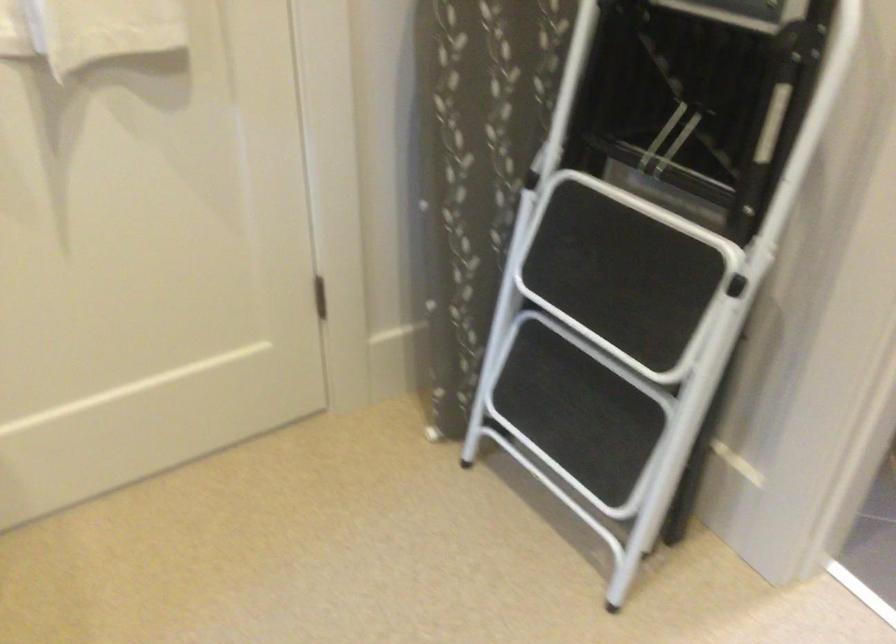
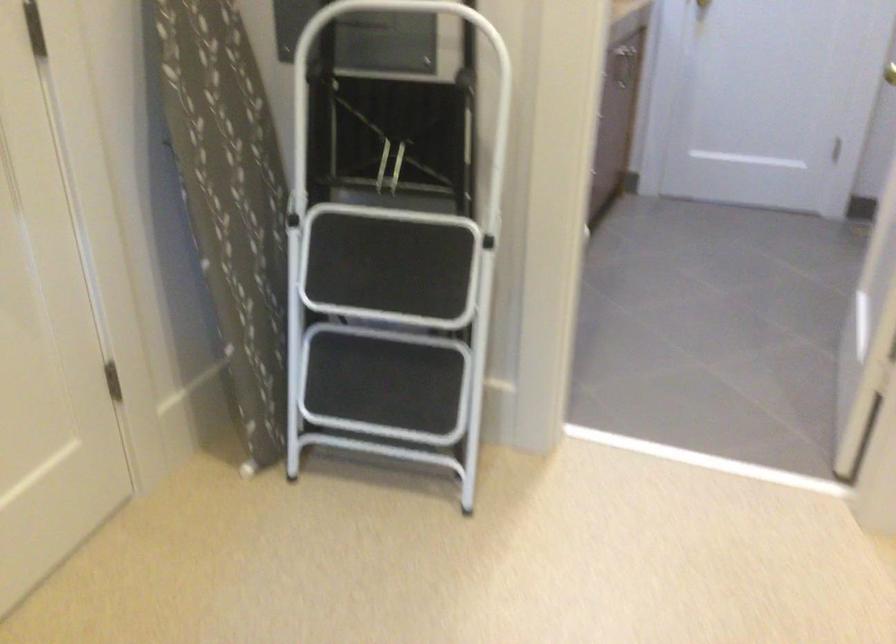
Question: How did the camera likely rotate?

Choices:
 (A) Left
 (B) Right
 (C) Up
 (D) Down

Answer: (B)